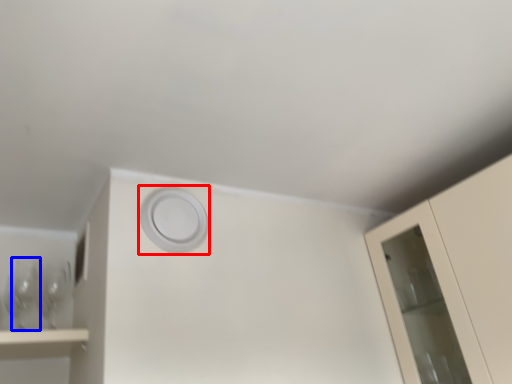
Question: Among these objects, which one is nearest to the camera, circle (highlighted by a red box) or wine glass (highlighted by a blue box)?

Choices:
 (A) circle
 (B) wine glass

Answer: (A)